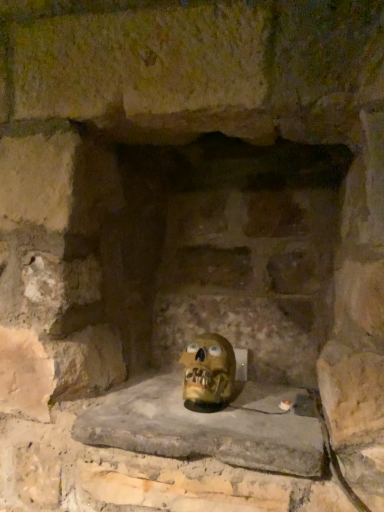
Identify the location of free space in front of matte yellow skull at center. (226, 424).